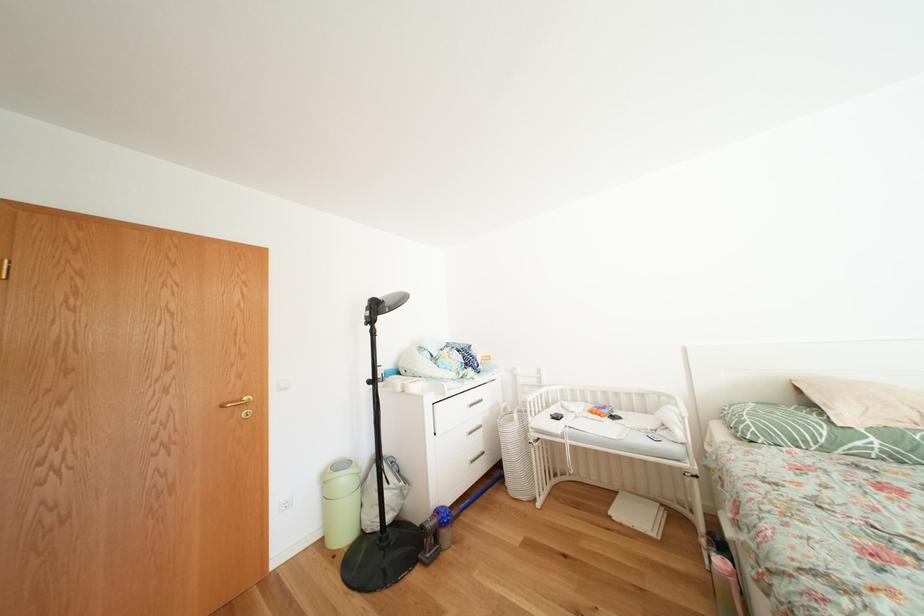
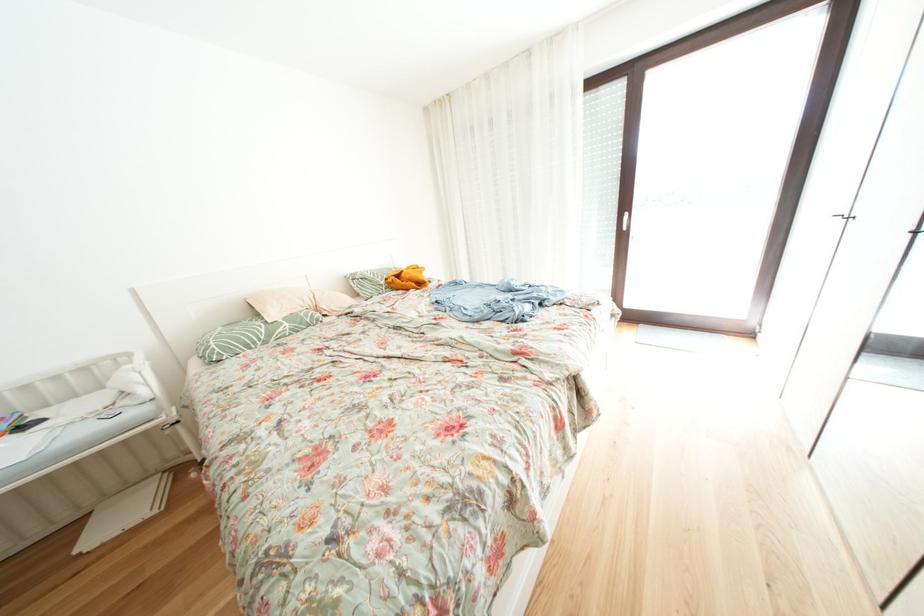
Locate, in the second image, the point that corresponds to pixel 883 445 in the first image.

(296, 329)